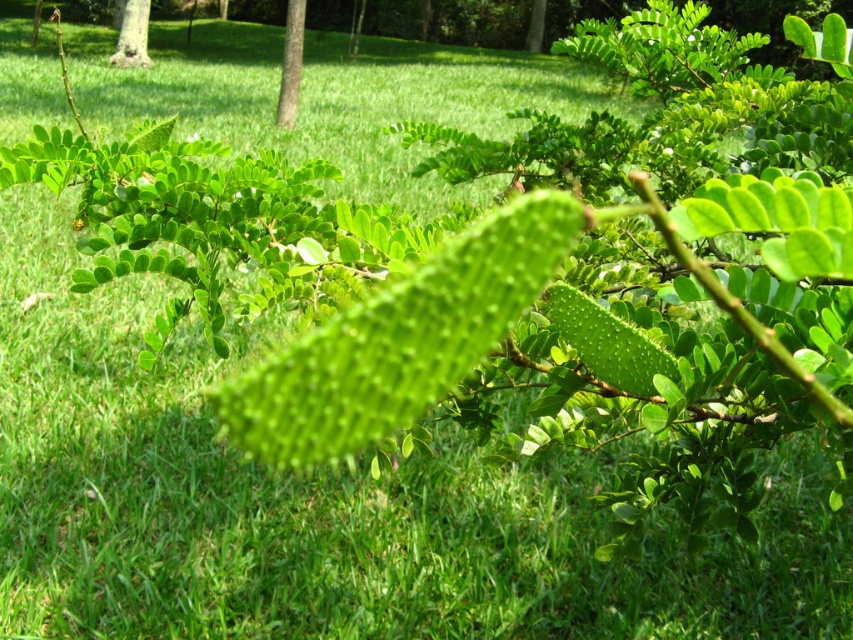
Who is positioned more to the right, green leafy tree at center or green matte tree at upper left?

green leafy tree at center is more to the right.

Is green leafy tree at center bigger than green matte tree at upper left?

Yes, green leafy tree at center is bigger than green matte tree at upper left.

The image size is (853, 640). Describe the element at coordinates (291, 64) in the screenshot. I see `green leafy tree at center` at that location.

You are a GUI agent. You are given a task and a screenshot of the screen. Output one action in this format:
    pyautogui.click(x=<x>, y=<y>)
    Task: Click on the green leafy tree at center
    Image resolution: width=853 pixels, height=640 pixels.
    Given the screenshot: What is the action you would take?
    pyautogui.click(x=291, y=64)